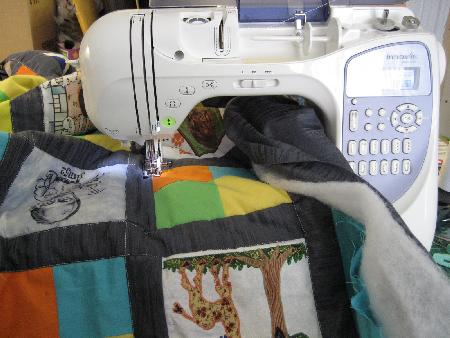
Where is `table`? table is located at coordinates (440, 227).